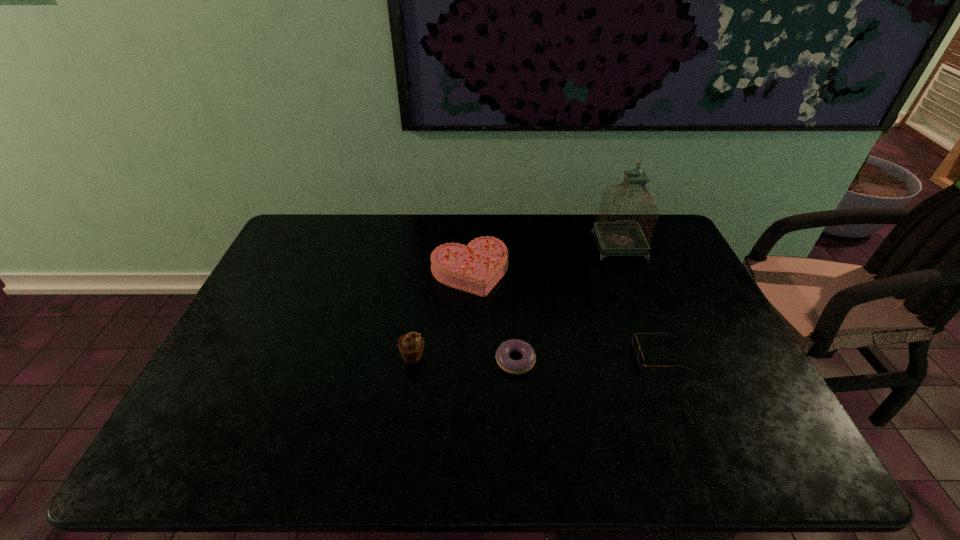
You are a GUI agent. You are given a task and a screenshot of the screen. Output one action in this format:
    pyautogui.click(x=<x>, y=<y>)
    Task: Click on the birdcage
    The image size is (960, 540).
    Given the screenshot: What is the action you would take?
    pyautogui.click(x=625, y=236)

What are the coordinates of `muffin` in the screenshot? It's located at (411, 345).

Identify the location of the third tallest object. The image size is (960, 540). (476, 268).

The image size is (960, 540). I want to click on sunglasses, so click(x=635, y=343).

Locate an element on the screen. doughnut is located at coordinates (526, 363).

Where is `free space located 0.100m at the door of the tallest object`? free space located 0.100m at the door of the tallest object is located at coordinates (633, 280).

This screenshot has width=960, height=540. Find the location of `free space located on the right of the muffin`. free space located on the right of the muffin is located at coordinates (544, 356).

This screenshot has width=960, height=540. I want to click on free space located 0.220m on the left of the third tallest object, so pyautogui.click(x=362, y=272).

Locate an element on the screen. Image resolution: width=960 pixels, height=540 pixels. vacant area located on the front-facing side of the sunglasses is located at coordinates (583, 354).

Where is `free spot located on the front-facing side of the sunglasses`? The height and width of the screenshot is (540, 960). free spot located on the front-facing side of the sunglasses is located at coordinates (583, 354).